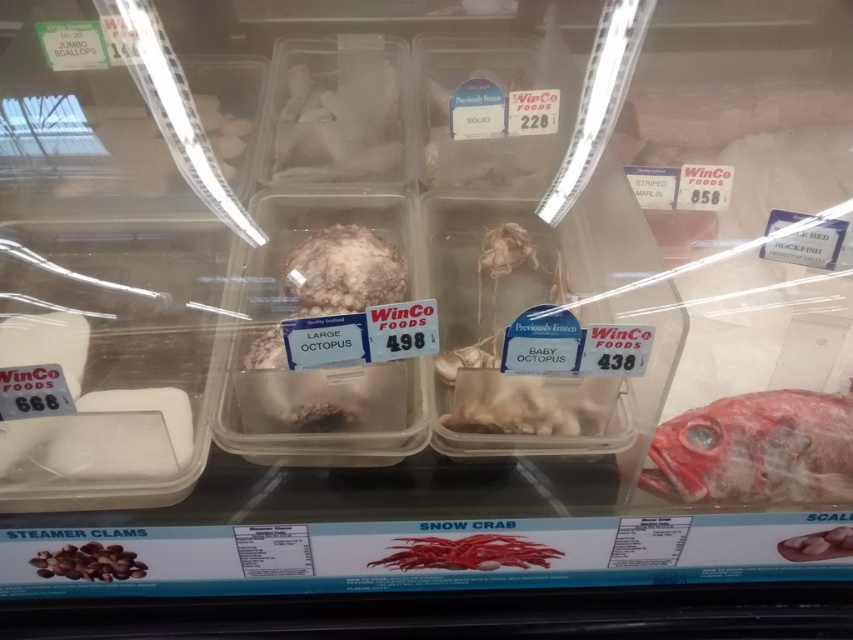
Does white matte octopus at center come in front of brown matte clams at lower left?

No, it is not.

How distant is white matte octopus at center from brown matte clams at lower left?

white matte octopus at center and brown matte clams at lower left are 22.22 inches apart.

What do you see at coordinates (343, 272) in the screenshot? I see `white matte octopus at center` at bounding box center [343, 272].

I want to click on white matte octopus at center, so click(x=343, y=272).

Does white frosted octopus at center appear over white matte octopus at center?

Yes.

Is white frosted octopus at center bigger than white matte octopus at center?

Indeed, white frosted octopus at center has a larger size compared to white matte octopus at center.

Between point (340, 113) and point (381, 259), which one is positioned in front?

Point (381, 259)

At what (x,y) coordinates should I click in order to perform the action: click on white frosted octopus at center. Please return your answer as a coordinate pair (x, y). This screenshot has height=640, width=853. Looking at the image, I should click on (339, 122).

How far apart are white frosted octopus at center and brown matte clams at lower left?

white frosted octopus at center and brown matte clams at lower left are 38.86 inches apart.

You are a GUI agent. You are given a task and a screenshot of the screen. Output one action in this format:
    pyautogui.click(x=<x>, y=<y>)
    Task: Click on the white frosted octopus at center
    Image resolution: width=853 pixels, height=640 pixels.
    Given the screenshot: What is the action you would take?
    pyautogui.click(x=339, y=122)

Where is `white frosted octopus at center`? white frosted octopus at center is located at coordinates (339, 122).